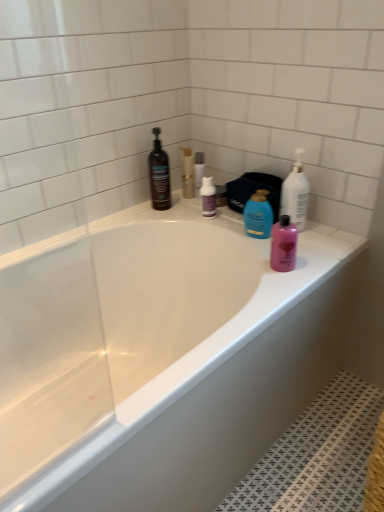
Locate an element on the screen. The image size is (384, 512). spots to the right of white glossy bottle at upper right, which ranks as the first cleaning product in right-to-left order is located at coordinates (326, 231).